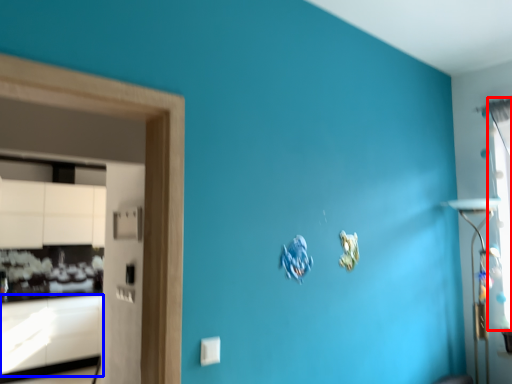
Question: Among these objects, which one is nearest to the camera, window (highlighted by a red box) or cabinetry (highlighted by a blue box)?

Choices:
 (A) window
 (B) cabinetry

Answer: (A)